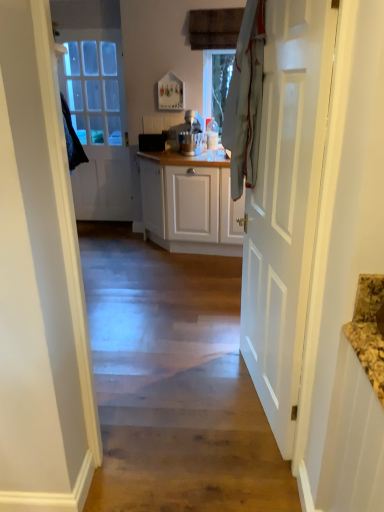
Question: In the image, is wooden floor at center on the left side or the right side of white matte stand mixer at center?

Choices:
 (A) left
 (B) right

Answer: (A)

Question: Considering the positions of wooden floor at center and white matte stand mixer at center in the image, is wooden floor at center taller or shorter than white matte stand mixer at center?

Choices:
 (A) short
 (B) tall

Answer: (A)

Question: Estimate the real-world distances between objects in this image. Which object is closer to the white glossy door at right, the 2th door in the back-to-front sequence?

Choices:
 (A) wooden floor at center
 (B) white glossy door at left, the 2th door from the right
 (C) white matte stand mixer at center

Answer: (A)

Question: Estimate the real-world distances between objects in this image. Which object is closer to the white glossy door at right, which is counted as the second door, starting from the left?

Choices:
 (A) white matte stand mixer at center
 (B) wooden floor at center
 (C) white glossy door at left, the first door positioned from the back

Answer: (B)